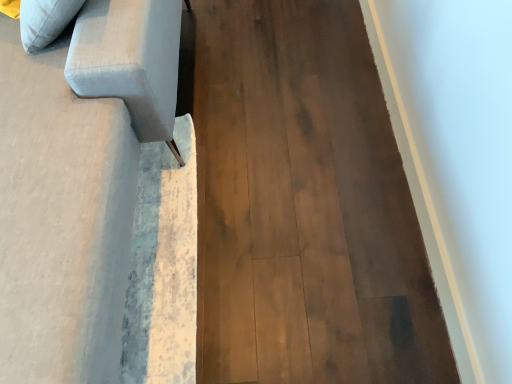
At what (x,y) coordinates should I click in order to perform the action: click on light gray fabric couch at left. Please return your answer as a coordinate pair (x, y). Looking at the image, I should click on (61, 220).

What do you see at coordinates (61, 220) in the screenshot?
I see `light gray fabric couch at left` at bounding box center [61, 220].

Describe the element at coordinates (305, 206) in the screenshot. This screenshot has height=384, width=512. I see `brown wood floor at center` at that location.

The height and width of the screenshot is (384, 512). In order to click on brown wood floor at center in this screenshot , I will do `click(305, 206)`.

I want to click on light gray fabric couch at left, so click(x=61, y=220).

Between light gray fabric couch at left and brown wood floor at center, which one appears on the left side from the viewer's perspective?

From the viewer's perspective, light gray fabric couch at left appears more on the left side.

Considering the positions of objects light gray fabric couch at left and brown wood floor at center in the image provided, who is in front, light gray fabric couch at left or brown wood floor at center?

light gray fabric couch at left is in front.

Which point is more forward, (x=113, y=104) or (x=325, y=17)?

Point (x=113, y=104)

From the image's perspective, is light gray fabric couch at left beneath brown wood floor at center?

No, from the image's perspective, light gray fabric couch at left is not below brown wood floor at center.

From a real-world perspective, which is physically above, light gray fabric couch at left or brown wood floor at center?

From a 3D spatial view, light gray fabric couch at left is above.

Between light gray fabric couch at left and brown wood floor at center, which one has smaller width?

brown wood floor at center is thinner.

From the picture: Considering the sizes of objects light gray fabric couch at left and brown wood floor at center in the image provided, who is taller, light gray fabric couch at left or brown wood floor at center?

light gray fabric couch at left.

Which of these two, light gray fabric couch at left or brown wood floor at center, is bigger?

Bigger between the two is light gray fabric couch at left.

Is light gray fabric couch at left located outside brown wood floor at center?

Yes.

From the picture: Would you say light gray fabric couch at left is a long distance from brown wood floor at center?

That's not correct — light gray fabric couch at left is a little close to brown wood floor at center.

Is light gray fabric couch at left aimed at brown wood floor at center?

No.

Can you tell me how much light gray fabric couch at left and brown wood floor at center differ in facing direction?

91.5 degrees separate the facing orientations of light gray fabric couch at left and brown wood floor at center.

Identify the location of plywood behind the light gray fabric couch at left. (305, 206).

Is brown wood floor at center at the right side of light gray fabric couch at left?

Yes.

Which object is further away from the camera, brown wood floor at center or light gray fabric couch at left?

brown wood floor at center is further away from the camera.

Which point is more forward, (x=424, y=313) or (x=23, y=309)?

The point (x=23, y=309) is closer.

From the image's perspective, which one is positioned higher, brown wood floor at center or light gray fabric couch at left?

light gray fabric couch at left is shown above in the image.

From a real-world perspective, which is physically below, brown wood floor at center or light gray fabric couch at left?

brown wood floor at center is physically lower.

Which object is wider, brown wood floor at center or light gray fabric couch at left?

With larger width is light gray fabric couch at left.

Who is shorter, brown wood floor at center or light gray fabric couch at left?

Standing shorter between the two is brown wood floor at center.

Can you confirm if brown wood floor at center is bigger than light gray fabric couch at left?

No, brown wood floor at center is not bigger than light gray fabric couch at left.

Do you think brown wood floor at center is within light gray fabric couch at left, or outside of it?

The correct answer is: outside.

Is brown wood floor at center next to light gray fabric couch at left and touching it?

There is a gap between brown wood floor at center and light gray fabric couch at left.

Is brown wood floor at center facing towards light gray fabric couch at left?

No, brown wood floor at center is not aimed at light gray fabric couch at left.

How far apart are brown wood floor at center and light gray fabric couch at left?

brown wood floor at center and light gray fabric couch at left are 19.05 inches apart from each other.

The width and height of the screenshot is (512, 384). In order to click on plywood located below the light gray fabric couch at left (from the image's perspective) in this screenshot , I will do `click(305, 206)`.

This screenshot has height=384, width=512. Find the location of `plywood that is below the light gray fabric couch at left (from the image's perspective)`. plywood that is below the light gray fabric couch at left (from the image's perspective) is located at coordinates (305, 206).

At what (x,y) coordinates should I click in order to perform the action: click on plywood below the light gray fabric couch at left (from a real-world perspective). Please return your answer as a coordinate pair (x, y). The image size is (512, 384). Looking at the image, I should click on (305, 206).